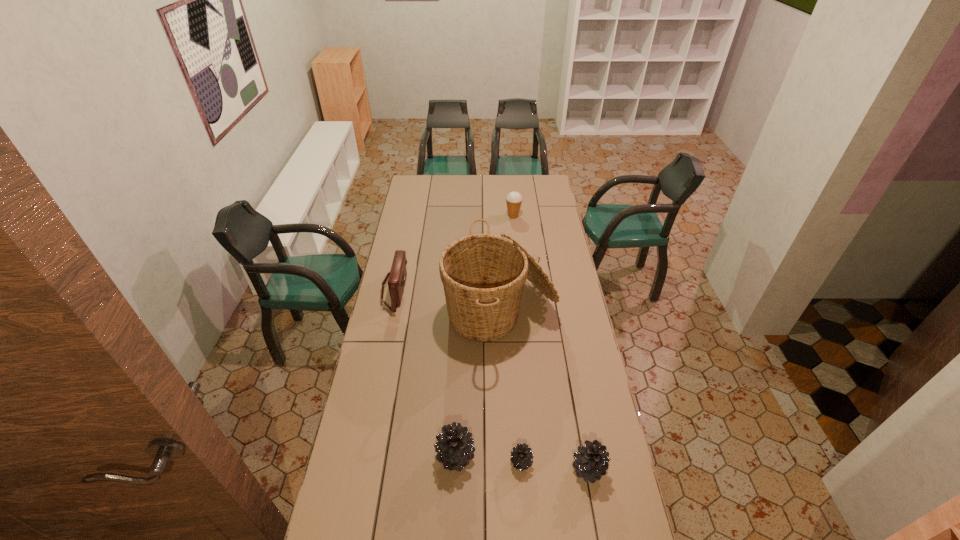
Locate an element on the screen. Image resolution: width=960 pixels, height=540 pixels. the third closest pinecone to the icecream is located at coordinates (591, 463).

Image resolution: width=960 pixels, height=540 pixels. Identify the location of free space that satisfies the following two spatial constraints: 1. on the back side of the shortest object; 2. on the right side of the icecream. (504, 216).

I want to click on blank area in the image that satisfies the following two spatial constraints: 1. on the front flap of the basket; 2. on the right side of the leftmost object, so click(390, 315).

You are a GUI agent. You are given a task and a screenshot of the screen. Output one action in this format:
    pyautogui.click(x=<x>, y=<y>)
    Task: Click on the vacant space that satisfies the following two spatial constraints: 1. on the front flap of the leftmost object; 2. on the right side of the second pinecone from right to left
    The width and height of the screenshot is (960, 540).
    Given the screenshot: What is the action you would take?
    pyautogui.click(x=359, y=462)

Locate an element on the screen. This screenshot has height=540, width=960. free location that satisfies the following two spatial constraints: 1. on the front flap of the rightmost pinecone; 2. on the right side of the leftmost object is located at coordinates (358, 469).

Identify the location of free spot that satisfies the following two spatial constraints: 1. on the front flap of the leftmost object; 2. on the left side of the shortest object. (359, 462).